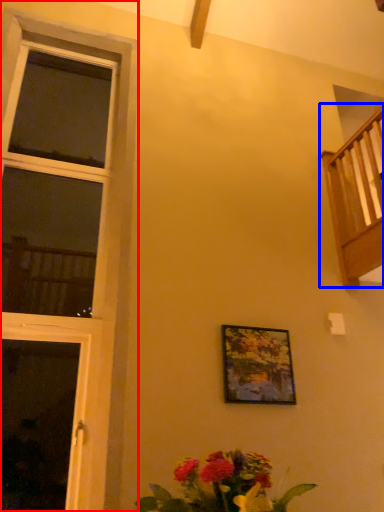
Question: Which object is closer to the camera taking this photo, window (highlighted by a red box) or balcony (highlighted by a blue box)?

Choices:
 (A) window
 (B) balcony

Answer: (A)